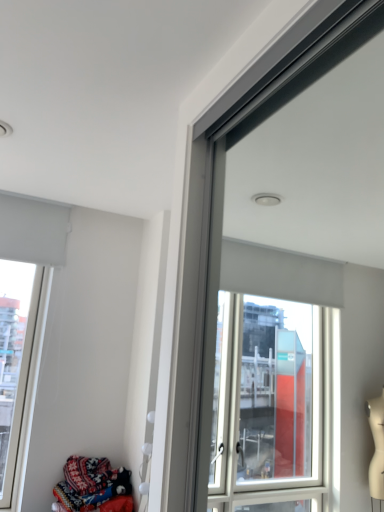
The image size is (384, 512). What do you see at coordinates (24, 323) in the screenshot?
I see `white matte window at upper left` at bounding box center [24, 323].

The width and height of the screenshot is (384, 512). Identify the location of white matte window at upper left. 24,323.

Measure the distance between white matte window at upper left and camera.

2.15 meters.

Measure the distance between patterned fabric at lower left and camera.

A distance of 6.75 feet exists between patterned fabric at lower left and camera.

Image resolution: width=384 pixels, height=512 pixels. Identify the location of patterned fabric at lower left. (90, 483).

What is the approximate height of patterned fabric at lower left?

patterned fabric at lower left is 9.04 inches tall.

Image resolution: width=384 pixels, height=512 pixels. Describe the element at coordinates (90, 483) in the screenshot. I see `patterned fabric at lower left` at that location.

I want to click on white matte window at upper left, so click(x=24, y=323).

Considering the relative positions of white matte window at upper left and patterned fabric at lower left in the image provided, is white matte window at upper left to the left or to the right of patterned fabric at lower left?

white matte window at upper left is to the left of patterned fabric at lower left.

Which object is further away from the camera taking this photo, white matte window at upper left or patterned fabric at lower left?

white matte window at upper left is further from the camera.

Considering the positions of points (20, 338) and (95, 508), is point (20, 338) farther from camera compared to point (95, 508)?

Yes, point (20, 338) is farther from viewer.

From the image's perspective, is white matte window at upper left beneath patterned fabric at lower left?

No, from the image's perspective, white matte window at upper left is not beneath patterned fabric at lower left.

From a real-world perspective, which is physically above, white matte window at upper left or patterned fabric at lower left?

white matte window at upper left is physically above.

In the scene shown: Can you confirm if white matte window at upper left is thinner than patterned fabric at lower left?

Indeed, white matte window at upper left has a lesser width compared to patterned fabric at lower left.

Is white matte window at upper left shorter than patterned fabric at lower left?

In fact, white matte window at upper left may be taller than patterned fabric at lower left.

Is white matte window at upper left bigger than patterned fabric at lower left?

Yes.

Is white matte window at upper left positioned beyond the bounds of patterned fabric at lower left?

white matte window at upper left lies outside patterned fabric at lower left's area.

Are white matte window at upper left and patterned fabric at lower left located far from each other?

No, white matte window at upper left is in close proximity to patterned fabric at lower left.

Is white matte window at upper left oriented towards patterned fabric at lower left?

No, white matte window at upper left is not oriented towards patterned fabric at lower left.

Looking at this image, can you tell me how much white matte window at upper left and patterned fabric at lower left differ in facing direction?

The facing directions of white matte window at upper left and patterned fabric at lower left are 90 degrees apart.

How distant is white matte window at upper left from patterned fabric at lower left?

white matte window at upper left and patterned fabric at lower left are 21.53 inches apart from each other.

Identify the location of clothing lying below the white matte window at upper left (from the image's perspective). (90, 483).

Is patterned fabric at lower left to the right of white matte window at upper left from the viewer's perspective?

Correct, you'll find patterned fabric at lower left to the right of white matte window at upper left.

Is patterned fabric at lower left behind white matte window at upper left?

No, patterned fabric at lower left is closer to the viewer.

Does point (118, 468) come closer to viewer compared to point (7, 313)?

Yes, point (118, 468) is closer to viewer.

From the image's perspective, between patterned fabric at lower left and white matte window at upper left, which one is located above?

white matte window at upper left.

From a real-world perspective, is patterned fabric at lower left located beneath white matte window at upper left?

Yes, from a real-world perspective, patterned fabric at lower left is under white matte window at upper left.

Considering the sizes of objects patterned fabric at lower left and white matte window at upper left in the image provided, who is wider, patterned fabric at lower left or white matte window at upper left?

Wider between the two is patterned fabric at lower left.

Which of these two, patterned fabric at lower left or white matte window at upper left, stands shorter?

Standing shorter between the two is patterned fabric at lower left.

Is patterned fabric at lower left smaller than white matte window at upper left?

Correct, patterned fabric at lower left occupies less space than white matte window at upper left.

Consider the image. Can white matte window at upper left be found inside patterned fabric at lower left?

That's incorrect, white matte window at upper left is not inside patterned fabric at lower left.

Are patterned fabric at lower left and white matte window at upper left beside each other?

No, patterned fabric at lower left is not making contact with white matte window at upper left.

Is patterned fabric at lower left positioned with its back to white matte window at upper left?

No, white matte window at upper left is not at the back of patterned fabric at lower left.

How many degrees apart are the facing directions of patterned fabric at lower left and white matte window at upper left?

They differ by 90 degrees in their facing directions.

Where is `clothing lying in front of the white matte window at upper left`? clothing lying in front of the white matte window at upper left is located at coordinates (90, 483).

Image resolution: width=384 pixels, height=512 pixels. What are the coordinates of `clothing in front of the white matte window at upper left` in the screenshot? It's located at (90, 483).

In the image, there is a white matte window at upper left. Identify the location of clothing below it (from a real-world perspective). This screenshot has width=384, height=512. (90, 483).